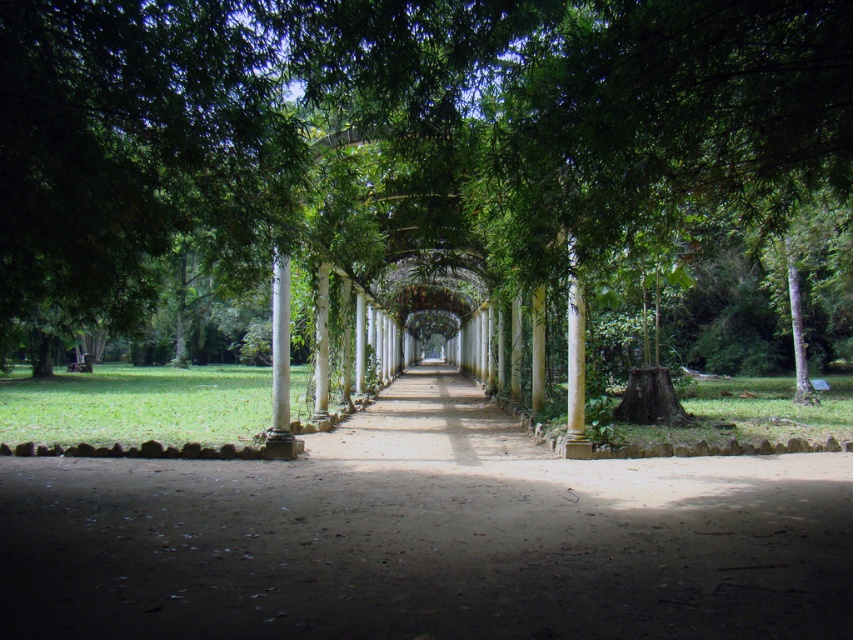
Question: Among these objects, which one is farthest from the camera?

Choices:
 (A) green leafy tree at center
 (B) smooth concrete alley at center

Answer: (A)

Question: Does green leafy tree at center appear on the left side of smooth concrete alley at center?

Choices:
 (A) yes
 (B) no

Answer: (B)

Question: Where is green leafy tree at center located in relation to smooth concrete alley at center in the image?

Choices:
 (A) left
 (B) right

Answer: (B)

Question: Does green leafy tree at center appear on the left side of smooth concrete alley at center?

Choices:
 (A) no
 (B) yes

Answer: (A)